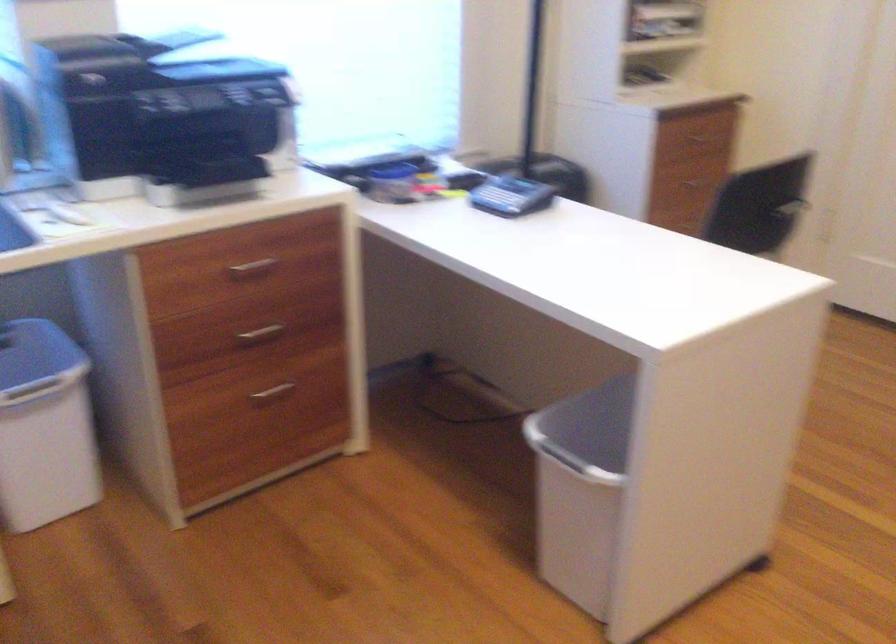
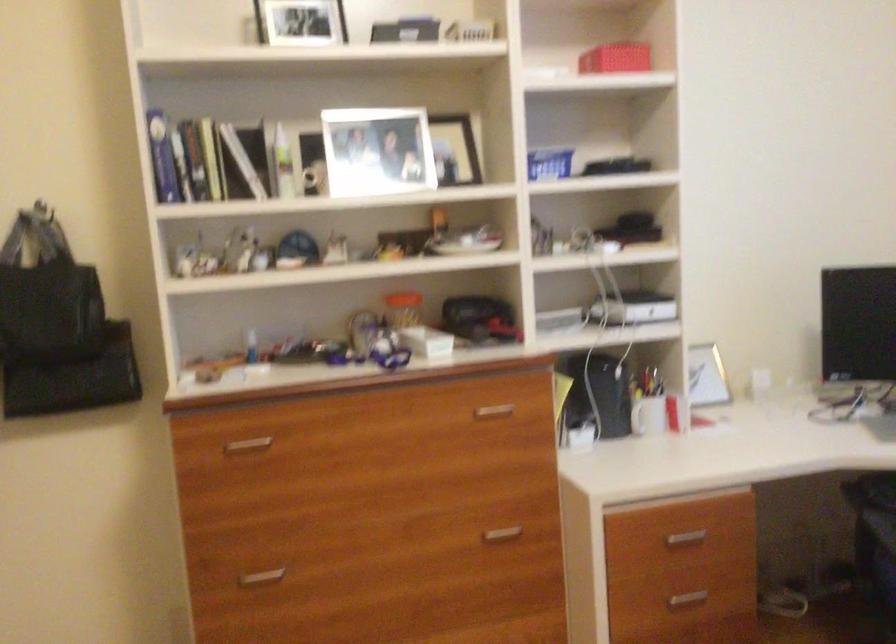
The images are taken continuously from a first-person perspective. In which direction is your viewpoint rotating?

The rotation direction of the camera is left-down.